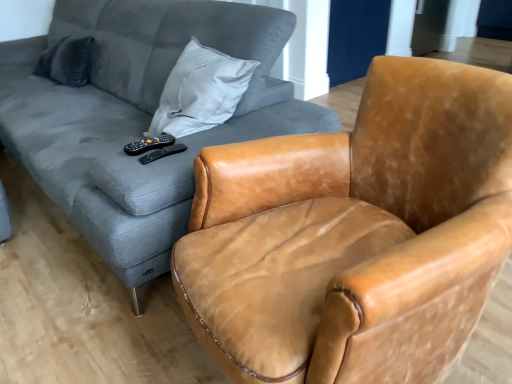
Question: Is leather armchair at center wider than dark gray fabric pillow at upper left?

Choices:
 (A) no
 (B) yes

Answer: (B)

Question: Is leather armchair at center completely or partially outside of dark gray fabric pillow at upper left?

Choices:
 (A) no
 (B) yes

Answer: (B)

Question: Is leather armchair at center positioned with its back to dark gray fabric pillow at upper left?

Choices:
 (A) no
 (B) yes

Answer: (A)

Question: Does leather armchair at center come in front of dark gray fabric pillow at upper left?

Choices:
 (A) yes
 (B) no

Answer: (A)

Question: From a real-world perspective, is leather armchair at center under dark gray fabric pillow at upper left?

Choices:
 (A) no
 (B) yes

Answer: (B)

Question: Does point (140, 77) appear closer or farther from the camera than point (132, 145)?

Choices:
 (A) closer
 (B) farther

Answer: (B)

Question: Looking at their shapes, would you say matte gray fabric couch at upper left is wider or thinner than black plastic remote at center, which is the second remote from right to left?

Choices:
 (A) wide
 (B) thin

Answer: (A)

Question: Visually, is matte gray fabric couch at upper left positioned to the left or to the right of black plastic remote at center, which is the second remote from right to left?

Choices:
 (A) right
 (B) left

Answer: (B)

Question: In the image, is matte gray fabric couch at upper left positioned in front of or behind black plastic remote at center, which is the second remote from right to left?

Choices:
 (A) behind
 (B) front

Answer: (B)

Question: Considering their positions, is matte gray fabric couch at upper left located in front of or behind black matte remote at center, the 2th remote when ordered from left to right?

Choices:
 (A) front
 (B) behind

Answer: (A)

Question: From a real-world perspective, is matte gray fabric couch at upper left above or below black matte remote at center, which is the 1th remote from right to left?

Choices:
 (A) below
 (B) above

Answer: (A)

Question: In terms of width, does matte gray fabric couch at upper left look wider or thinner when compared to black matte remote at center, the 2th remote when ordered from left to right?

Choices:
 (A) thin
 (B) wide

Answer: (B)

Question: Considering the positions of point [x=245, y=36] and point [x=166, y=148], is point [x=245, y=36] closer or farther from the camera than point [x=166, y=148]?

Choices:
 (A) farther
 (B) closer

Answer: (A)

Question: Is point (466, 64) closer or farther from the camera than point (173, 150)?

Choices:
 (A) farther
 (B) closer

Answer: (B)

Question: From their relative heights in the image, would you say leather armchair at center is taller or shorter than black matte remote at center, which is the 1th remote from right to left?

Choices:
 (A) tall
 (B) short

Answer: (A)